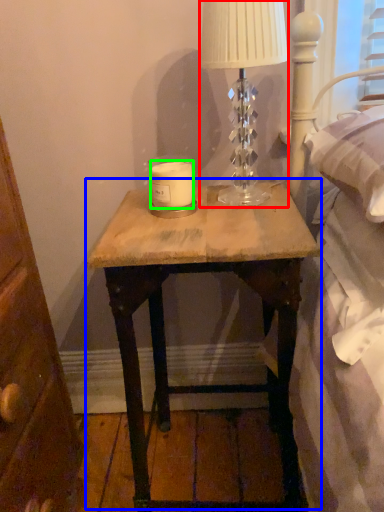
Question: Which object is positioned farthest from table lamp (highlighted by a red box)? Select from nightstand (highlighted by a blue box) and candle (highlighted by a green box).

Choices:
 (A) nightstand
 (B) candle

Answer: (A)